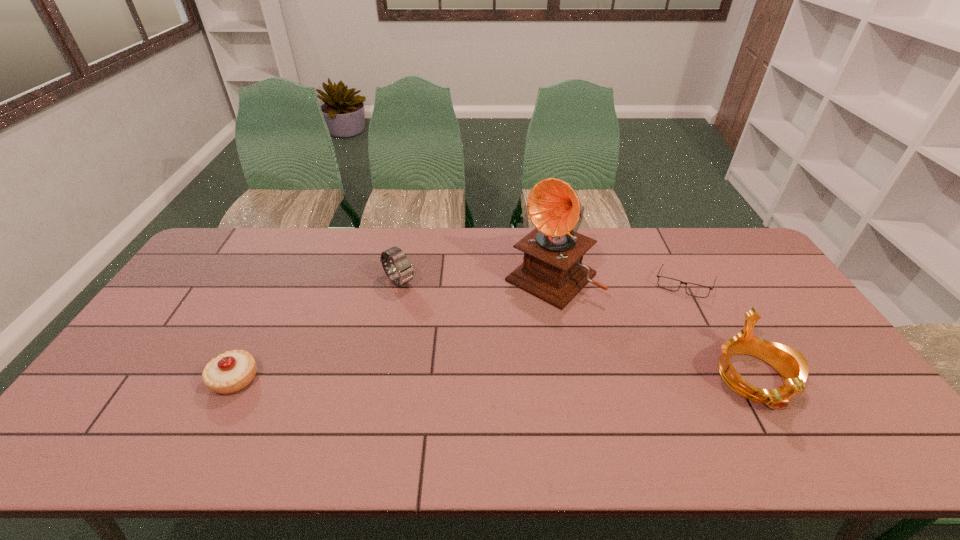
Where is `free point located 0.070m on the horn of the third object from left to right`? Image resolution: width=960 pixels, height=540 pixels. free point located 0.070m on the horn of the third object from left to right is located at coordinates (511, 315).

At what (x,y) coordinates should I click in order to perform the action: click on vacant area situated 0.070m with the lenses facing outward on the shortest object. Please return your answer as a coordinate pair (x, y). Looking at the image, I should click on (647, 302).

You are a GUI agent. You are given a task and a screenshot of the screen. Output one action in this format:
    pyautogui.click(x=<x>, y=<y>)
    Task: Click on the free space located 0.370m with the lenses facing outward on the shortest object
    
    Given the screenshot: What is the action you would take?
    pyautogui.click(x=572, y=342)

I want to click on vacant space situated with the lenses facing outward on the shortest object, so click(638, 307).

Where is `vacant area located on the face of the watch`? This screenshot has height=540, width=960. vacant area located on the face of the watch is located at coordinates (448, 326).

I want to click on vacant space located on the face of the watch, so click(x=420, y=300).

Where is `vacant region located 0.330m on the face of the watch`? vacant region located 0.330m on the face of the watch is located at coordinates (478, 352).

Image resolution: width=960 pixels, height=540 pixels. Identify the location of phonograph record present at the far edge. (552, 270).

Where is `spectacles that is at the far edge`? The image size is (960, 540). spectacles that is at the far edge is located at coordinates (696, 290).

Locate an element on the screen. This screenshot has height=540, width=960. watch that is at the far edge is located at coordinates (405, 273).